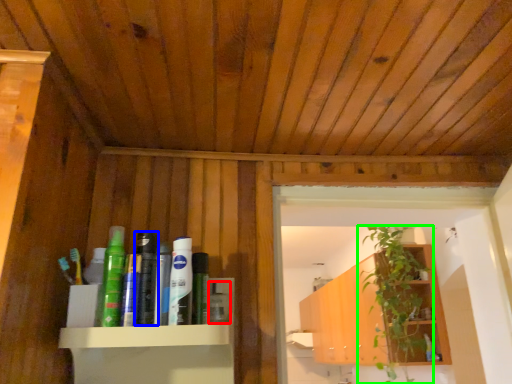
Question: Considering the real-world distances, which object is farthest from toiletry (highlighted by a red box)? toiletry (highlighted by a blue box) or houseplant (highlighted by a green box)?

Choices:
 (A) toiletry
 (B) houseplant

Answer: (B)